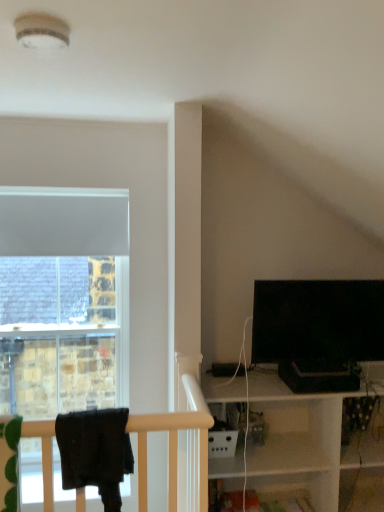
The width and height of the screenshot is (384, 512). What do you see at coordinates (95, 452) in the screenshot? I see `black fabric at left` at bounding box center [95, 452].

The height and width of the screenshot is (512, 384). I want to click on black fabric at left, so (x=95, y=452).

This screenshot has height=512, width=384. I want to click on black glossy tv at right, so click(318, 320).

Measure the distance between point (x=315, y=348) and camera.

7.26 feet.

The image size is (384, 512). Describe the element at coordinates (318, 320) in the screenshot. I see `black glossy tv at right` at that location.

What is the approximate height of black glossy tv at right?

black glossy tv at right is 18.77 inches in height.

You are a GUI agent. You are given a task and a screenshot of the screen. Output one action in this format:
    pyautogui.click(x=<x>, y=<y>)
    Task: Click on the black fabric at left
    This screenshot has width=384, height=512.
    Given the screenshot: What is the action you would take?
    pyautogui.click(x=95, y=452)

Can you confirm if black fabric at left is positioned to the right of black glossy tv at right?

In fact, black fabric at left is to the left of black glossy tv at right.

Is the position of black fabric at left more distant than that of black glossy tv at right?

No, black fabric at left is closer to the camera.

Does point (117, 502) come in front of point (381, 349)?

That is True.

From the image's perspective, would you say black fabric at left is positioned over black glossy tv at right?

Actually, black fabric at left appears below black glossy tv at right in the image.

From a real-world perspective, is black fabric at left located higher than black glossy tv at right?

No, from a real-world perspective, black fabric at left is not over black glossy tv at right

Is black fabric at left wider or thinner than black glossy tv at right?

In the image, black fabric at left appears to be wider than black glossy tv at right.

Considering the relative sizes of black fabric at left and black glossy tv at right in the image provided, is black fabric at left taller than black glossy tv at right?

No.

Is black fabric at left bigger than black glossy tv at right?

No, black fabric at left is not bigger than black glossy tv at right.

Is black glossy tv at right a part of black fabric at left?

Actually, black glossy tv at right is outside black fabric at left.

Can you see black fabric at left touching black glossy tv at right?

No, black fabric at left is not beside black glossy tv at right.

Is black fabric at left aimed at black glossy tv at right?

No, black fabric at left is not turned towards black glossy tv at right.

Can you tell me how much black fabric at left and black glossy tv at right differ in facing direction?

The facing directions of black fabric at left and black glossy tv at right are 3.28 degrees apart.

In the image, there is a black glossy tv at right. Where is `laundry below it (from the image's perspective)`? laundry below it (from the image's perspective) is located at coordinates (95, 452).

Which object is positioned more to the left, black glossy tv at right or black fabric at left?

From the viewer's perspective, black fabric at left appears more on the left side.

Which object is more forward, black glossy tv at right or black fabric at left?

Positioned in front is black fabric at left.

Does point (266, 313) lie in front of point (102, 473)?

No, it is not.

From the image's perspective, is black glossy tv at right located beneath black fabric at left?

No, from the image's perspective, black glossy tv at right is not beneath black fabric at left.

From a real-world perspective, between black glossy tv at right and black fabric at left, who is vertically higher?

In real-world perspective, black glossy tv at right is above.

Considering the sizes of objects black glossy tv at right and black fabric at left in the image provided, who is thinner, black glossy tv at right or black fabric at left?

With smaller width is black glossy tv at right.

Which of these two, black glossy tv at right or black fabric at left, stands taller?

black glossy tv at right.

Who is smaller, black glossy tv at right or black fabric at left?

black fabric at left.

Is black glossy tv at right completely or partially outside of black fabric at left?

black glossy tv at right lies outside black fabric at left's area.

Is the surface of black glossy tv at right in direct contact with black fabric at left?

black glossy tv at right is not next to black fabric at left, and they're not touching.

Could you tell me if black glossy tv at right is turned towards black fabric at left?

No, black glossy tv at right is not aimed at black fabric at left.

What's the angular difference between black glossy tv at right and black fabric at left's facing directions?

black glossy tv at right and black fabric at left are facing 3.28 degrees away from each other.

Locate an element on the screen. television on the right of the black fabric at left is located at coordinates (318, 320).

This screenshot has width=384, height=512. Find the location of `laundry lying on the left of black glossy tv at right`. laundry lying on the left of black glossy tv at right is located at coordinates (95, 452).

Identify the location of television above the black fabric at left (from a real-world perspective). (318, 320).